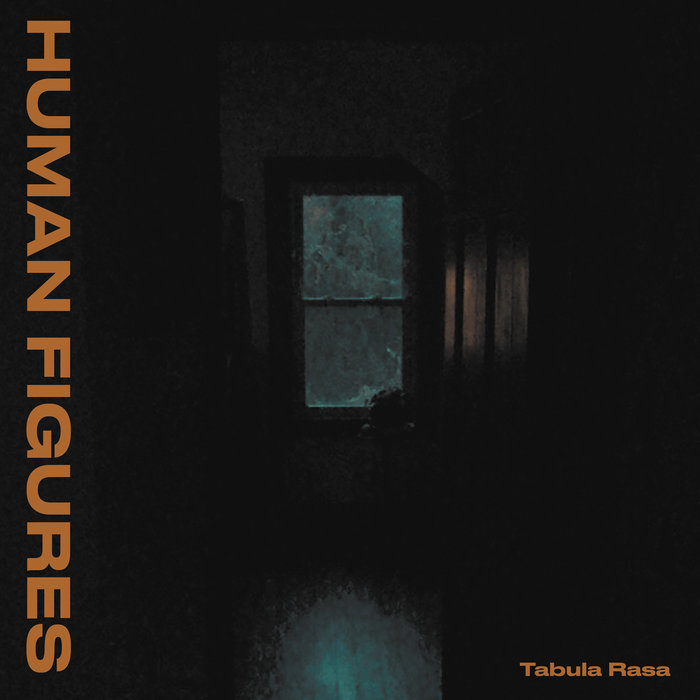
Where is `wall`? Image resolution: width=700 pixels, height=700 pixels. wall is located at coordinates (350, 115).